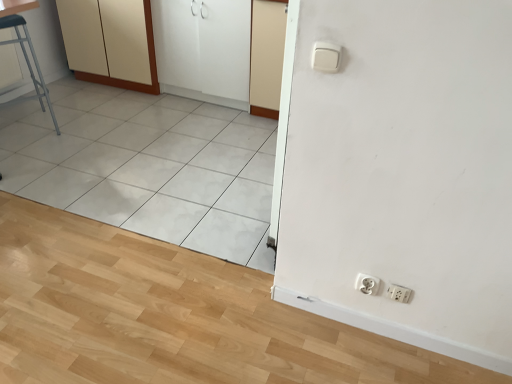
Where is `white plastic socket at lower right, placed as the first socket when sorted from right to left`? The width and height of the screenshot is (512, 384). white plastic socket at lower right, placed as the first socket when sorted from right to left is located at coordinates (399, 293).

What do you see at coordinates (367, 284) in the screenshot? The image size is (512, 384). I see `white plastic socket at lower right, which is counted as the second socket, starting from the right` at bounding box center [367, 284].

What is the approximate width of metallic stool at left?

metallic stool at left is 18.39 inches in width.

Identify the location of white matte screen door at upper center, which ranks as the second screen door in left-to-right order. (266, 56).

From the image's perspective, which is below, white plastic socket at lower right, which ranks as the second socket in left-to-right order, or white glossy cabinet at upper left, which is counted as the 2th screen door, starting from the right?

white plastic socket at lower right, which ranks as the second socket in left-to-right order, appears lower in the image.

Considering their positions, is white plastic socket at lower right, placed as the first socket when sorted from right to left, located in front of or behind white glossy cabinet at upper left, arranged as the 1th screen door when viewed from the left?

In the image, white plastic socket at lower right, placed as the first socket when sorted from right to left, appears in front of white glossy cabinet at upper left, arranged as the 1th screen door when viewed from the left.

Consider the image. Between white plastic socket at lower right, which ranks as the second socket in left-to-right order, and white glossy cabinet at upper left, which is counted as the 2th screen door, starting from the right, which one has larger width?

Wider between the two is white glossy cabinet at upper left, which is counted as the 2th screen door, starting from the right.

Is matte cream cabinet at upper left beside white glossy cabinet at upper left, which is counted as the 2th screen door, starting from the right?

matte cream cabinet at upper left and white glossy cabinet at upper left, which is counted as the 2th screen door, starting from the right, are not in contact.

Does point (89, 21) lie in front of point (234, 28)?

No, (89, 21) is behind (234, 28).

From the image's perspective, which screen door is the 1st one below the matte cream cabinet at upper left? Please provide its 2D coordinates.

[(204, 49)]

From the image's perspective, would you say matte cream cabinet at upper left is shown under white glossy cabinet at upper left, arranged as the 1th screen door when viewed from the left?

Incorrect, from the image's perspective, matte cream cabinet at upper left is higher than white glossy cabinet at upper left, arranged as the 1th screen door when viewed from the left.

What's the angular difference between metallic stool at left and white plastic socket at lower right, which is counted as the second socket, starting from the right,'s facing directions?

61.6 degrees separate the facing orientations of metallic stool at left and white plastic socket at lower right, which is counted as the second socket, starting from the right.

Is metallic stool at left closer to the viewer compared to white plastic socket at lower right, which is counted as the first socket, starting from the left?

That is False.

Consider the image. From a real-world perspective, is metallic stool at left below white plastic socket at lower right, which is counted as the first socket, starting from the left?

No, from a real-world perspective, metallic stool at left is not beneath white plastic socket at lower right, which is counted as the first socket, starting from the left.

Considering the positions of objects white plastic socket at lower right, placed as the first socket when sorted from right to left, and matte cream cabinet at upper left in the image provided, who is behind, white plastic socket at lower right, placed as the first socket when sorted from right to left, or matte cream cabinet at upper left?

matte cream cabinet at upper left is more distant.

Would you say white plastic socket at lower right, which ranks as the second socket in left-to-right order, contains matte cream cabinet at upper left?

That's incorrect, matte cream cabinet at upper left is not inside white plastic socket at lower right, which ranks as the second socket in left-to-right order.

Does point (390, 291) come closer to viewer compared to point (67, 31)?

Yes.

Is white matte screen door at upper center, which ranks as the second screen door in left-to-right order, at the back of white plastic socket at lower right, which is counted as the second socket, starting from the right?

white plastic socket at lower right, which is counted as the second socket, starting from the right, does not have its back to white matte screen door at upper center, which ranks as the second screen door in left-to-right order.

How different are the orientations of white plastic socket at lower right, which is counted as the first socket, starting from the left, and white matte screen door at upper center, which ranks as the second screen door in left-to-right order, in degrees?

The angular difference between white plastic socket at lower right, which is counted as the first socket, starting from the left, and white matte screen door at upper center, which ranks as the second screen door in left-to-right order, is 0.000378 degrees.

In the scene shown: Can you confirm if white plastic socket at lower right, which is counted as the first socket, starting from the left, is positioned to the left of white matte screen door at upper center, which ranks as the second screen door in left-to-right order?

Incorrect, white plastic socket at lower right, which is counted as the first socket, starting from the left, is not on the left side of white matte screen door at upper center, which ranks as the second screen door in left-to-right order.

Which object is thinner, white plastic socket at lower right, which is counted as the second socket, starting from the right, or white matte screen door at upper center, which appears as the first screen door when viewed from the right?

Thinner between the two is white plastic socket at lower right, which is counted as the second socket, starting from the right.

Is white plastic socket at lower right, which is counted as the second socket, starting from the right, at the back of white glossy cabinet at upper left, arranged as the 1th screen door when viewed from the left?

white glossy cabinet at upper left, arranged as the 1th screen door when viewed from the left, does not have its back to white plastic socket at lower right, which is counted as the second socket, starting from the right.

From the picture: Which object is thinner, white glossy cabinet at upper left, which is counted as the 2th screen door, starting from the right, or white plastic socket at lower right, which is counted as the first socket, starting from the left?

white plastic socket at lower right, which is counted as the first socket, starting from the left, is thinner.

Does white glossy cabinet at upper left, which is counted as the 2th screen door, starting from the right, appear on the left side of white plastic socket at lower right, which is counted as the first socket, starting from the left?

Yes, white glossy cabinet at upper left, which is counted as the 2th screen door, starting from the right, is to the left of white plastic socket at lower right, which is counted as the first socket, starting from the left.

From the image's perspective, is metallic stool at left below white glossy cabinet at upper left, arranged as the 1th screen door when viewed from the left?

Correct, metallic stool at left appears lower than white glossy cabinet at upper left, arranged as the 1th screen door when viewed from the left, in the image.

Does metallic stool at left turn towards white glossy cabinet at upper left, which is counted as the 2th screen door, starting from the right?

No, metallic stool at left is not turned towards white glossy cabinet at upper left, which is counted as the 2th screen door, starting from the right.

Is metallic stool at left situated inside white glossy cabinet at upper left, which is counted as the 2th screen door, starting from the right, or outside?

The correct answer is: outside.

From the image's perspective, which screen door is the 2nd one above the metallic stool at left? Please provide its 2D coordinates.

[(204, 49)]

From the image's perspective, which socket is the 2nd one below the white glossy cabinet at upper left, which is counted as the 2th screen door, starting from the right? Please provide its 2D coordinates.

[(399, 293)]

Identify the location of dresser on the left of white glossy cabinet at upper left, arranged as the 1th screen door when viewed from the left. (110, 42).

Consider the image. Looking at the image, which one is located further to white glossy cabinet at upper left, which is counted as the 2th screen door, starting from the right, white plastic socket at lower right, which ranks as the second socket in left-to-right order, or white matte screen door at upper center, which ranks as the second screen door in left-to-right order?

white plastic socket at lower right, which ranks as the second socket in left-to-right order, is positioned further to the anchor white glossy cabinet at upper left, which is counted as the 2th screen door, starting from the right.

Considering their positions, is metallic stool at left positioned further to white plastic socket at lower right, which ranks as the second socket in left-to-right order, than white matte screen door at upper center, which ranks as the second screen door in left-to-right order?

metallic stool at left is further to white plastic socket at lower right, which ranks as the second socket in left-to-right order.

Looking at the image, which one is located closer to white matte screen door at upper center, which ranks as the second screen door in left-to-right order, metallic stool at left or white plastic socket at lower right, which is counted as the first socket, starting from the left?

Based on the image, metallic stool at left appears to be nearer to white matte screen door at upper center, which ranks as the second screen door in left-to-right order.

When comparing their distances from white plastic socket at lower right, which ranks as the second socket in left-to-right order, does white matte screen door at upper center, which appears as the first screen door when viewed from the right, or metallic stool at left seem closer?

white matte screen door at upper center, which appears as the first screen door when viewed from the right.

From the image, which object appears to be nearer to white matte screen door at upper center, which appears as the first screen door when viewed from the right, white glossy cabinet at upper left, arranged as the 1th screen door when viewed from the left, or matte cream cabinet at upper left?

Based on the image, white glossy cabinet at upper left, arranged as the 1th screen door when viewed from the left, appears to be nearer to white matte screen door at upper center, which appears as the first screen door when viewed from the right.

From the image, which object appears to be nearer to white plastic socket at lower right, which is counted as the first socket, starting from the left, white glossy cabinet at upper left, arranged as the 1th screen door when viewed from the left, or matte cream cabinet at upper left?

white glossy cabinet at upper left, arranged as the 1th screen door when viewed from the left, is positioned closer to the anchor white plastic socket at lower right, which is counted as the first socket, starting from the left.

Which object lies nearer to the anchor point white glossy cabinet at upper left, arranged as the 1th screen door when viewed from the left, white plastic socket at lower right, which is counted as the second socket, starting from the right, or white matte screen door at upper center, which appears as the first screen door when viewed from the right?

Based on the image, white matte screen door at upper center, which appears as the first screen door when viewed from the right, appears to be nearer to white glossy cabinet at upper left, arranged as the 1th screen door when viewed from the left.

Which object lies further to the anchor point metallic stool at left, white matte screen door at upper center, which ranks as the second screen door in left-to-right order, or white plastic socket at lower right, which ranks as the second socket in left-to-right order?

The object further to metallic stool at left is white plastic socket at lower right, which ranks as the second socket in left-to-right order.

Image resolution: width=512 pixels, height=384 pixels. In order to click on screen door between white glossy cabinet at upper left, which is counted as the 2th screen door, starting from the right, and white plastic socket at lower right, which ranks as the second socket in left-to-right order, in the up-down direction in this screenshot , I will do `click(266, 56)`.

Where is `dresser between metallic stool at left and white plastic socket at lower right, which is counted as the first socket, starting from the left`? The width and height of the screenshot is (512, 384). dresser between metallic stool at left and white plastic socket at lower right, which is counted as the first socket, starting from the left is located at coordinates (110, 42).

I want to click on socket that lies between white matte screen door at upper center, which appears as the first screen door when viewed from the right, and white plastic socket at lower right, placed as the first socket when sorted from right to left, from top to bottom, so click(x=367, y=284).

Find the location of a particular element. screen door between matte cream cabinet at upper left and white matte screen door at upper center, which appears as the first screen door when viewed from the right, in the horizontal direction is located at coordinates (204, 49).